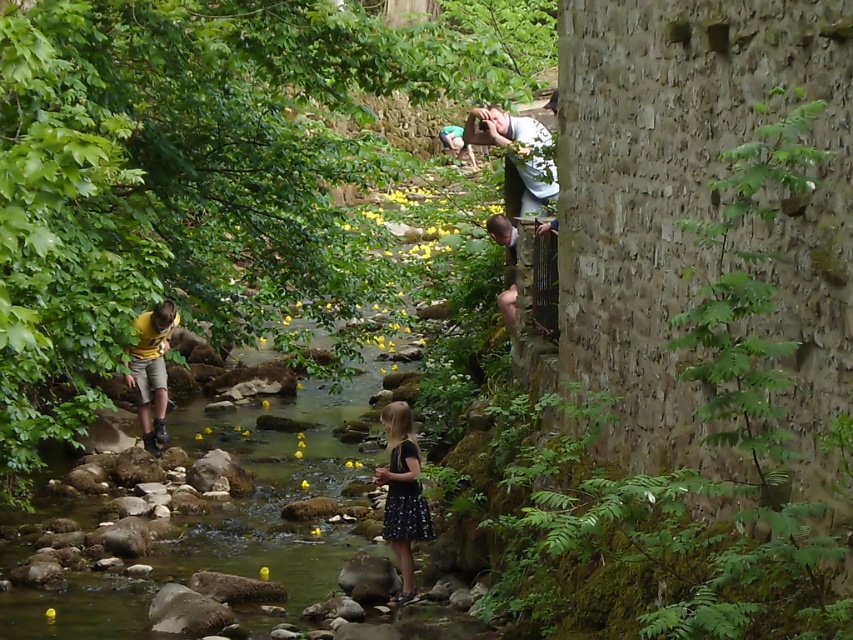
You are a parent supervising children playing near a stream. You see the black dotted skirt at center and the yellow matte shorts at center. Which child is farther away from you?

The black dotted skirt at center is farther away from you than the yellow matte shorts at center because the distance between them is 14.02 feet.

You are a parent supervising children playing near the stream. You notice the white cotton shirt at upper center and the yellow matte shorts at center. Can you safely walk between them to check on the children?

The distance between the white cotton shirt at upper center and the yellow matte shorts at center is 3.91 meters, so yes, you can safely walk between them to check on the children.